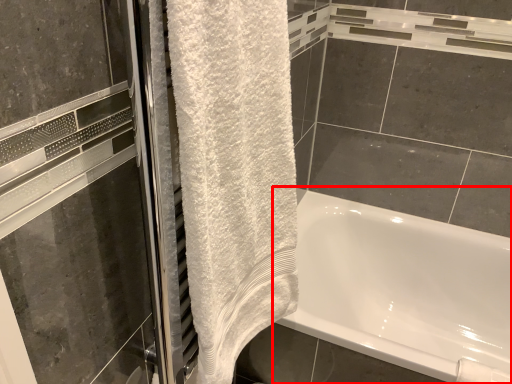
Question: Considering the relative positions of bathtub (annotated by the red box) and towel in the image provided, where is bathtub (annotated by the red box) located with respect to the staircase?

Choices:
 (A) left
 (B) right

Answer: (B)